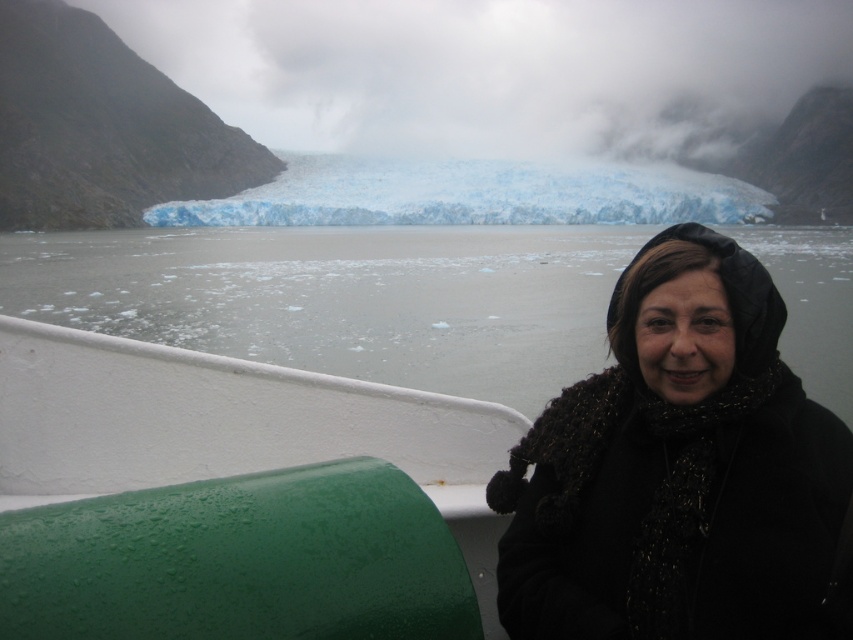
Is point (227, 387) positioned behind point (526, 204)?

No, (227, 387) is closer to viewer.

Is point (83, 483) behind point (671, 172)?

No, it is not.

Identify the location of green rubber tube at lower left. (219, 419).

Looking at this image, is gray ice at lower center smaller than blue ice glacier at center?

Indeed, gray ice at lower center has a smaller size compared to blue ice glacier at center.

This screenshot has height=640, width=853. What are the coordinates of `gray ice at lower center` in the screenshot? It's located at (343, 298).

Is point (772, 474) farther from camera compared to point (369, 340)?

No.

Which of these two, black knitted scarf at center or gray ice at lower center, stands taller?

gray ice at lower center is taller.

Which is in front, point (744, 547) or point (358, 369)?

Point (744, 547) is in front.

In order to click on black knitted scarf at center in this screenshot , I will do `click(680, 472)`.